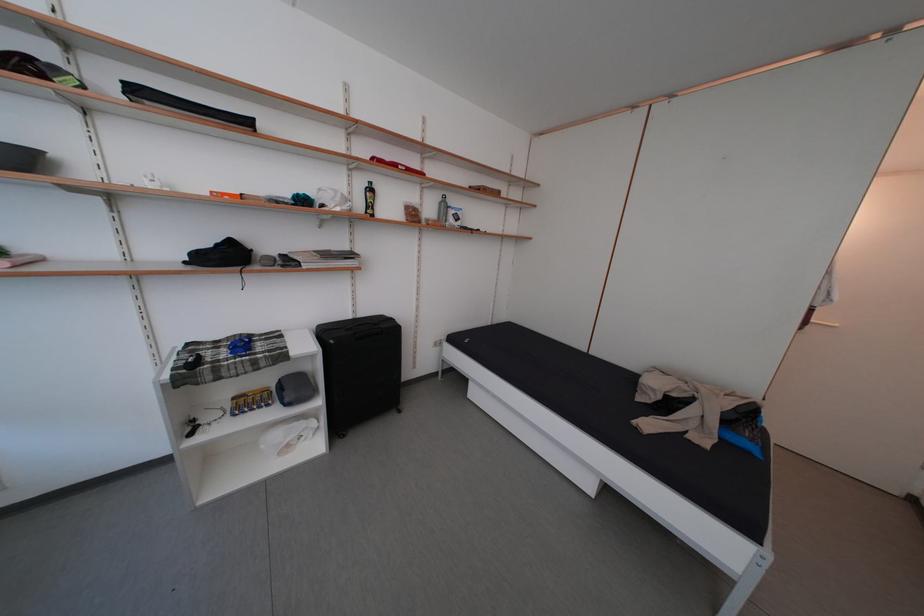
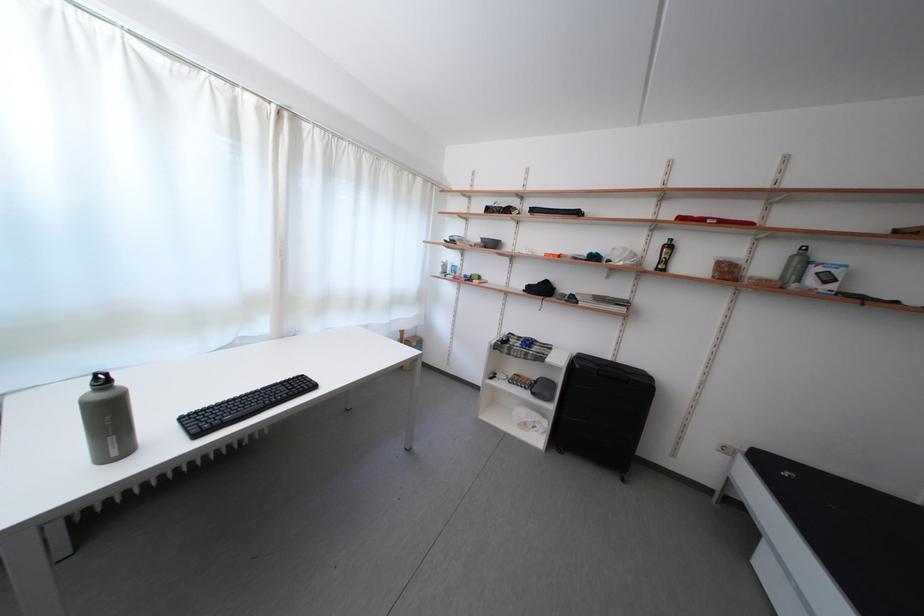
Find the pixel in the second image that matches point 359,322 in the first image.

(617, 363)